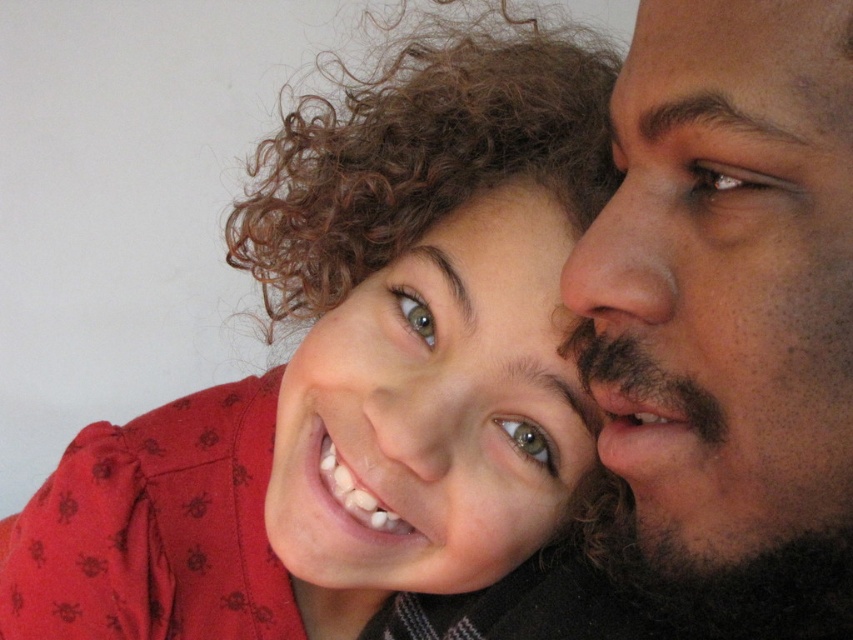
Question: Can you confirm if matte red shirt at center is positioned to the right of dark skin face at right?

Choices:
 (A) no
 (B) yes

Answer: (A)

Question: Estimate the real-world distances between objects in this image. Which object is closer to the dark skin face at right?

Choices:
 (A) smooth skin face at center
 (B) matte red shirt at center

Answer: (A)

Question: Which point is closer to the camera?

Choices:
 (A) dark skin face at right
 (B) matte red shirt at center

Answer: (A)

Question: Does matte red shirt at center appear on the right side of dark skin face at right?

Choices:
 (A) no
 (B) yes

Answer: (A)

Question: Which of these objects is positioned closest to the dark skin face at right?

Choices:
 (A) matte red shirt at center
 (B) smooth skin face at center

Answer: (B)

Question: Does matte red shirt at center have a larger size compared to dark skin face at right?

Choices:
 (A) yes
 (B) no

Answer: (A)